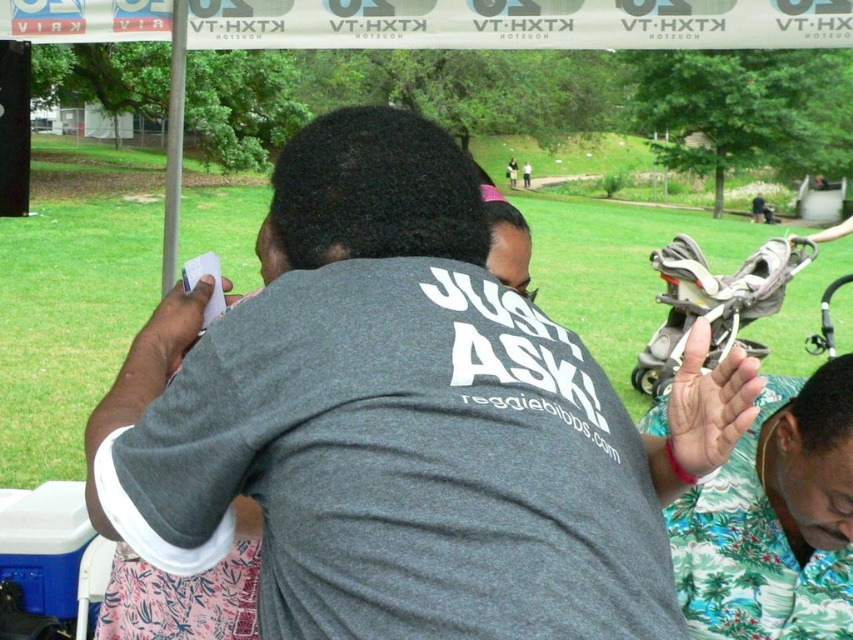
Describe the element at coordinates (401, 420) in the screenshot. The width and height of the screenshot is (853, 640). I see `gray matte t-shirt at center` at that location.

Does gray matte t-shirt at center appear under green floral shirt at lower right?

No, gray matte t-shirt at center is not below green floral shirt at lower right.

Where is `gray matte t-shirt at center`? This screenshot has width=853, height=640. gray matte t-shirt at center is located at coordinates (401, 420).

Is green floral shirt at lower right wider than white fabric canopy at upper center?

Incorrect, green floral shirt at lower right's width does not surpass white fabric canopy at upper center's.

Measure the distance from green floral shirt at lower right to white fabric canopy at upper center.

green floral shirt at lower right is 6.75 feet away from white fabric canopy at upper center.

You are a GUI agent. You are given a task and a screenshot of the screen. Output one action in this format:
    pyautogui.click(x=<x>, y=<y>)
    Task: Click on the green floral shirt at lower right
    The image size is (853, 640).
    Given the screenshot: What is the action you would take?
    pyautogui.click(x=775, y=520)

Where is `green floral shirt at lower right`? The width and height of the screenshot is (853, 640). green floral shirt at lower right is located at coordinates (775, 520).

Is gray matte t-shirt at center shorter than white fabric canopy at upper center?

No.

Between point (612, 552) and point (393, 38), which one is positioned in front?

Positioned in front is point (612, 552).

Is point (358, 490) farther from viewer compared to point (383, 48)?

No, it is not.

I want to click on gray matte t-shirt at center, so click(401, 420).